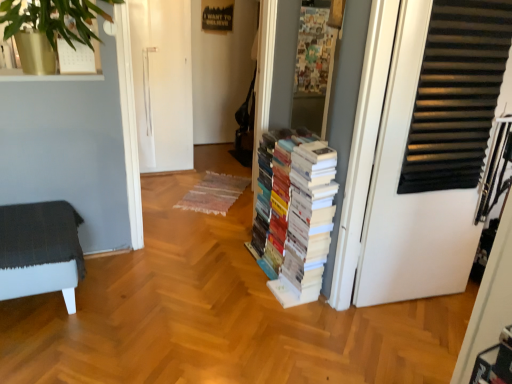
Image resolution: width=512 pixels, height=384 pixels. I want to click on free point in front of white paper books at center, so click(x=262, y=329).